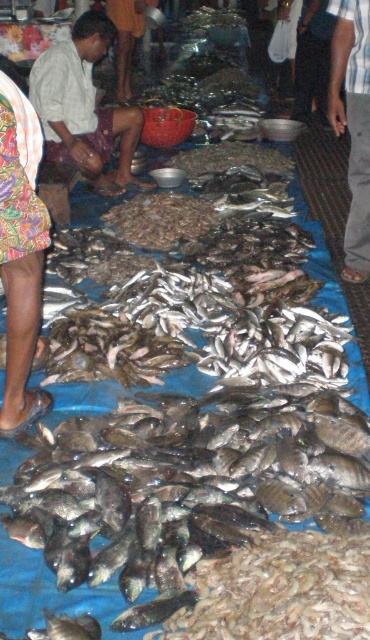
You are a customer at the fish market and want to buy both the shiny dark fish at center and the printed fabric skirt at lower left. Which item should you pick up first if you want to handle the larger item first?

The shiny dark fish at center is bigger than the printed fabric skirt at lower left, so you should pick up the shiny dark fish at center first.

You are a customer at the fish market and want to pick up the item at point (155,557) and the item at point (9,241). Which item will you reach first if you approach from the front of the table?

The item at point (155,557) will be reached first because it is closer to the camera than the item at point (9,241).